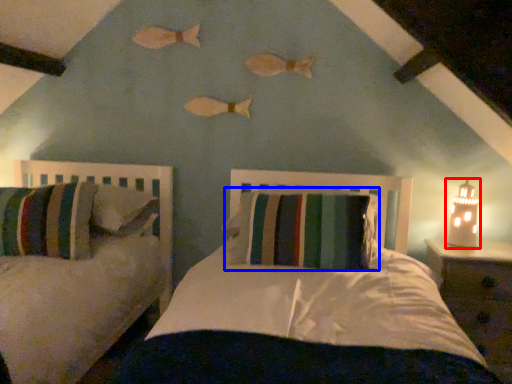
Question: Among these objects, which one is nearest to the camera, table lamp (highlighted by a red box) or pillow (highlighted by a blue box)?

Choices:
 (A) table lamp
 (B) pillow

Answer: (B)